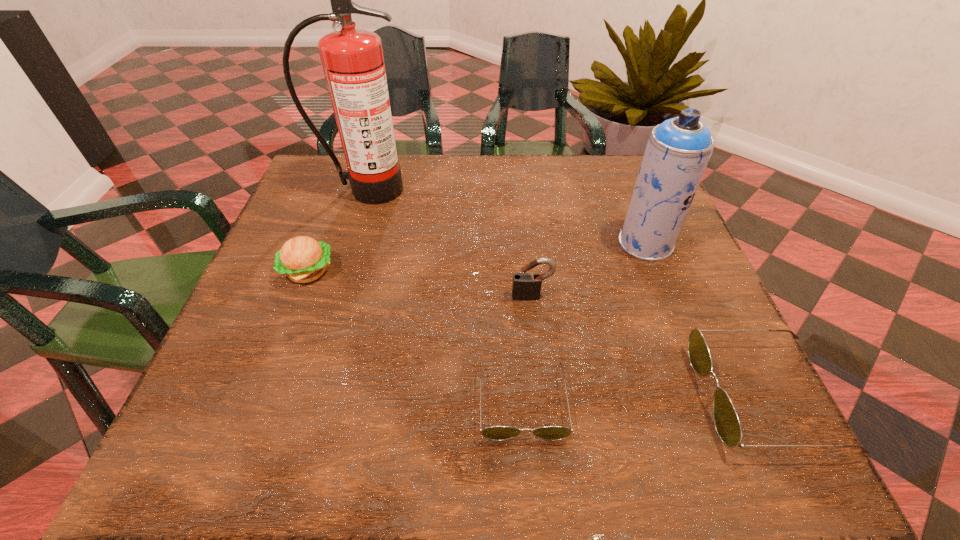
Locate an element on the screen. The width and height of the screenshot is (960, 540). empty space between the aerosol can and the fourth farthest object is located at coordinates (588, 269).

Locate an element on the screen. The height and width of the screenshot is (540, 960). free space between the second tallest object and the shorter sunglasses is located at coordinates (584, 322).

This screenshot has height=540, width=960. In order to click on vacant space that's between the padlock and the shortest object in this screenshot , I will do `click(527, 348)`.

I want to click on vacant area that lies between the right sunglasses and the third nearest object, so click(x=648, y=346).

I want to click on unoccupied area between the padlock and the right sunglasses, so click(648, 346).

The height and width of the screenshot is (540, 960). Identify the location of vacant space that's between the shortest object and the fifth tallest object. (643, 399).

Locate an element on the screen. This screenshot has width=960, height=540. vacant region between the taller sunglasses and the fifth shortest object is located at coordinates (705, 320).

Find the location of `free point between the tallest object and the third shortest object`. free point between the tallest object and the third shortest object is located at coordinates tap(338, 231).

Locate an element on the screen. The width and height of the screenshot is (960, 540). vacant area that lies between the right sunglasses and the fourth tallest object is located at coordinates (536, 334).

Find the location of a particular element. blank region between the shorter sunglasses and the hamburger is located at coordinates (416, 336).